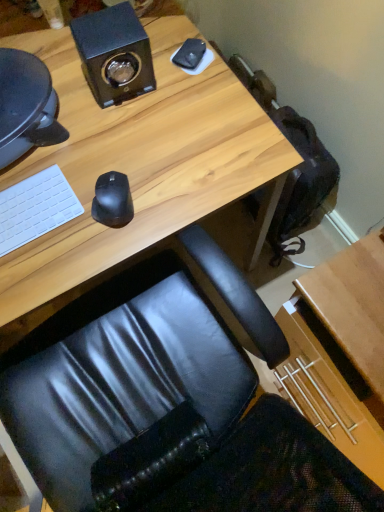
Where is `vacant point to the right of white matte keyboard at left`? The height and width of the screenshot is (512, 384). vacant point to the right of white matte keyboard at left is located at coordinates (96, 210).